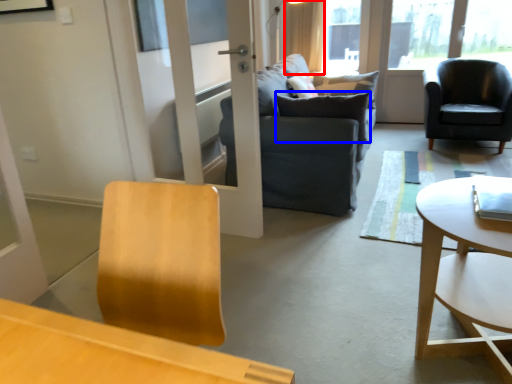
Question: Among these objects, which one is farthest to the camera, curtain (highlighted by a red box) or pillow (highlighted by a blue box)?

Choices:
 (A) curtain
 (B) pillow

Answer: (A)